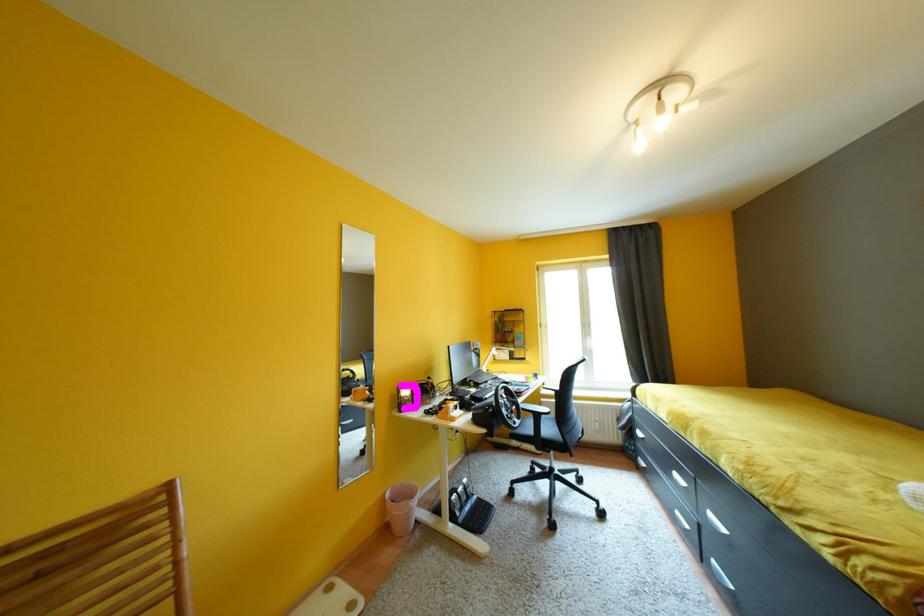
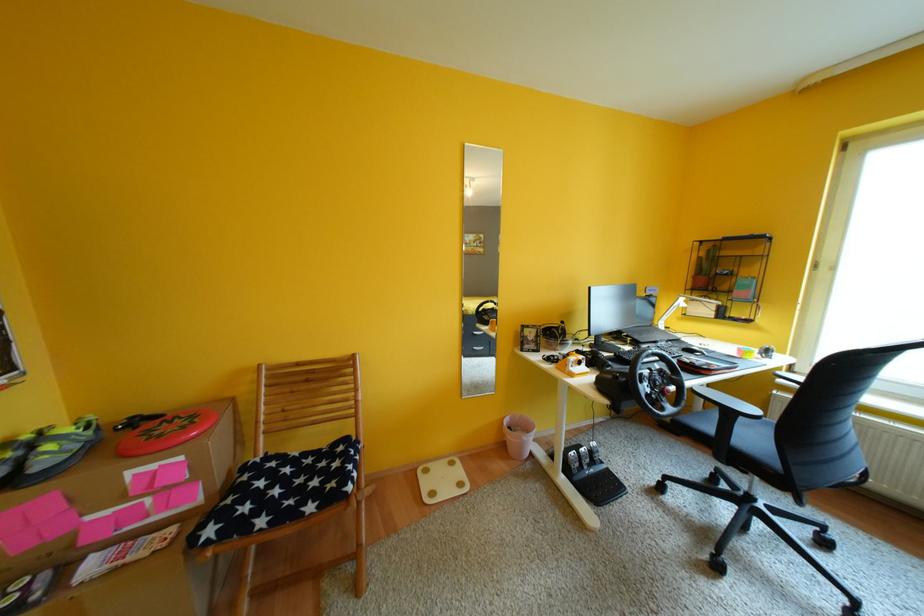
Question: The camera is either moving clockwise (left) or counter-clockwise (right) around the object. The first image is from the beginning of the video and the second image is from the end. Is the camera moving left or right when shooting the video?

Choices:
 (A) Left
 (B) Right

Answer: (B)